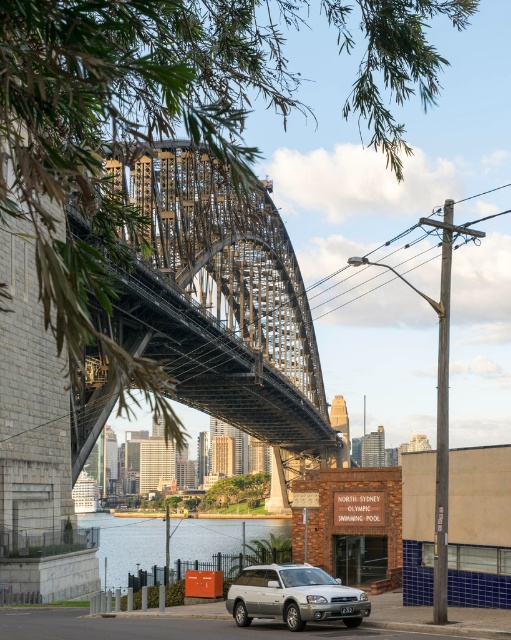
You are standing at the base of the Sydney Harbour Bridge and see the point labeled as point (127, 544). What is the location of this point relative to the blue water at lower left?

The point (127, 544) corresponds to the blue water at lower left, so it is located at the blue water at lower left.

You are a photographer planning to take a photo of the Sydney Harbour Bridge. You notice the blue water at lower left and the silver metallic station wagon at center in your frame. Based on their positions, which object appears closer to you?

The blue water at lower left appears closer to you because it is taller than the silver metallic station wagon at center in the image.

You are a delivery driver who needs to back up your silver metallic station wagon at center to make space for a large truck. The truck requires at least 60 meters of clearance between the wagon and the metallic steel bridge at center. Can you safely back up your wagon to meet this requirement?

The metallic steel bridge at center is currently 62.27 meters away from the silver metallic station wagon at center. Since the required clearance is at least 60 meters, the distance is sufficient. Therefore, you can safely back up the wagon without needing to move it further away from the bridge.